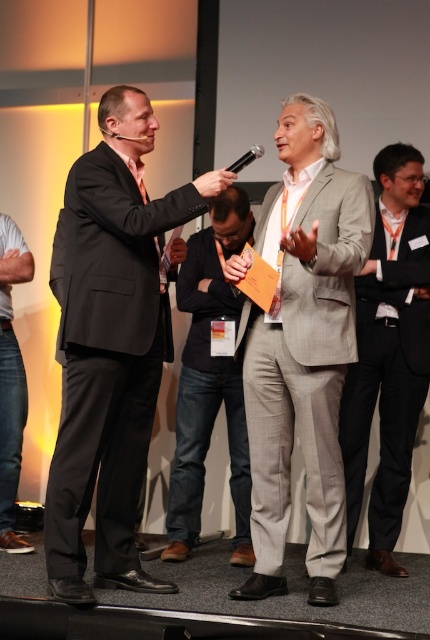
Who is taller, gray textured suit at center or denim jeans at lower left?

With more height is gray textured suit at center.

The width and height of the screenshot is (430, 640). What do you see at coordinates (306, 372) in the screenshot?
I see `gray textured suit at center` at bounding box center [306, 372].

The image size is (430, 640). Find the location of `gray textured suit at center`. gray textured suit at center is located at coordinates (306, 372).

Can you confirm if dark gray jeans at center is bigger than black plastic microphone at center?

Yes.

Based on the photo, is dark gray jeans at center closer to the viewer compared to black plastic microphone at center?

No.

Where is `dark gray jeans at center`? dark gray jeans at center is located at coordinates (209, 381).

The image size is (430, 640). What do you see at coordinates (107, 356) in the screenshot?
I see `black matte suit at left` at bounding box center [107, 356].

Is black matte suit at left taller than gray textured suit at center?

Yes.

Between point (86, 218) and point (261, 333), which one is positioned behind?

The point (261, 333) is more distant.

You are a GUI agent. You are given a task and a screenshot of the screen. Output one action in this format:
    pyautogui.click(x=<x>, y=<y>)
    Task: Click on the black matte suit at left
    The width and height of the screenshot is (430, 640).
    Given the screenshot: What is the action you would take?
    pyautogui.click(x=107, y=356)